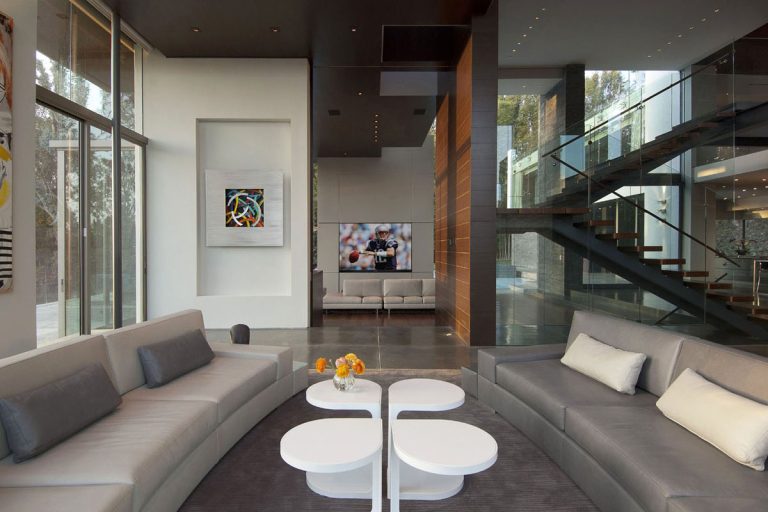
Locate an element on the screen. This screenshot has width=768, height=512. stair is located at coordinates (647, 274), (659, 152).